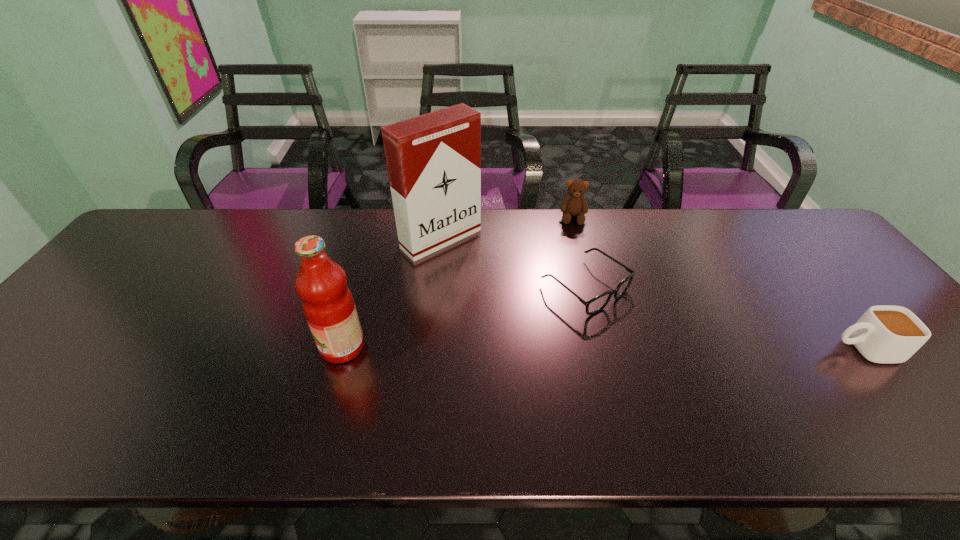
Locate an element on the screen. vacant point located between the spectacles and the fourth object from right to left is located at coordinates (514, 262).

Locate an element on the screen. empty space that is in between the spectacles and the second tallest object is located at coordinates (464, 316).

Identify the location of vacant area between the second shortest object and the fruit juice. (603, 348).

At what (x,y) coordinates should I click in order to perform the action: click on empty space between the shortest object and the leftmost object. Please return your answer as a coordinate pair (x, y). The width and height of the screenshot is (960, 540). Looking at the image, I should click on (464, 316).

The image size is (960, 540). Find the location of `vacant area that lies between the teddy bear and the spectacles`. vacant area that lies between the teddy bear and the spectacles is located at coordinates (579, 252).

In order to click on unoccupied area between the shortest object and the second tallest object in this screenshot , I will do `click(464, 316)`.

Where is `free point between the leftmost object and the tallest object`? This screenshot has width=960, height=540. free point between the leftmost object and the tallest object is located at coordinates (392, 293).

The image size is (960, 540). Find the location of `free space that is in between the cigarette_case and the second shortest object`. free space that is in between the cigarette_case and the second shortest object is located at coordinates (652, 294).

Locate an element on the screen. vacant point located between the second tallest object and the teddy bear is located at coordinates (458, 282).

Find the location of a particular element. The height and width of the screenshot is (540, 960). unoccupied area between the fruit juice and the teddy bear is located at coordinates (458, 282).